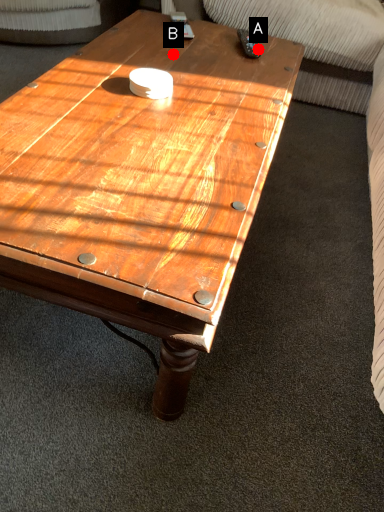
Question: Two points are circled on the image, labeled by A and B beside each circle. Which point is farther from the camera taking this photo?

Choices:
 (A) A is further
 (B) B is further

Answer: (A)